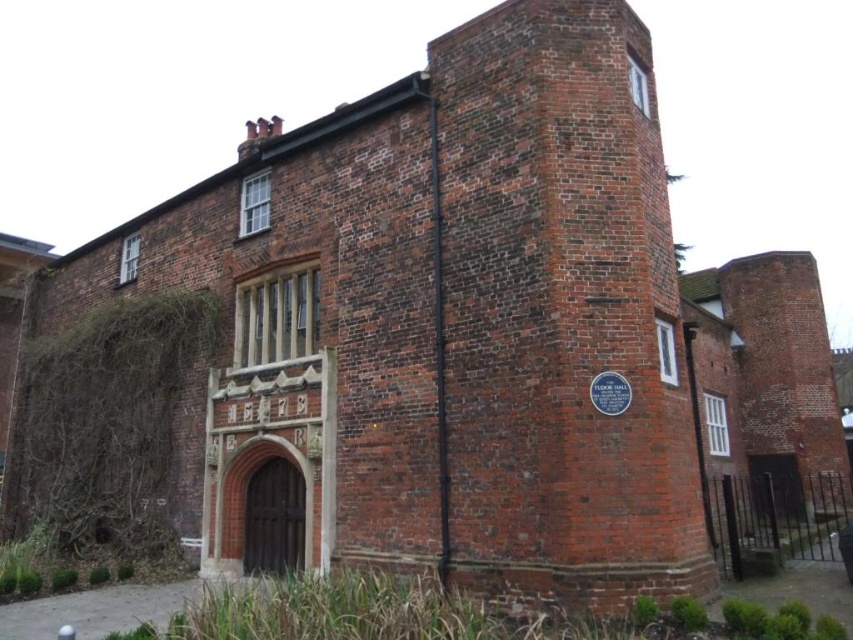
Question: Is green leafy ivy at left further to camera compared to white plastic clock at upper right?

Choices:
 (A) yes
 (B) no

Answer: (A)

Question: Which point is farther to the camera?

Choices:
 (A) white plastic clock at upper right
 (B) green leafy ivy at left

Answer: (B)

Question: Among these points, which one is farthest from the camera?

Choices:
 (A) (631, 83)
 (B) (42, 465)

Answer: (B)

Question: Is green leafy ivy at left thinner than white plastic clock at upper right?

Choices:
 (A) yes
 (B) no

Answer: (A)

Question: Can you confirm if green leafy ivy at left is thinner than white plastic clock at upper right?

Choices:
 (A) no
 (B) yes

Answer: (B)